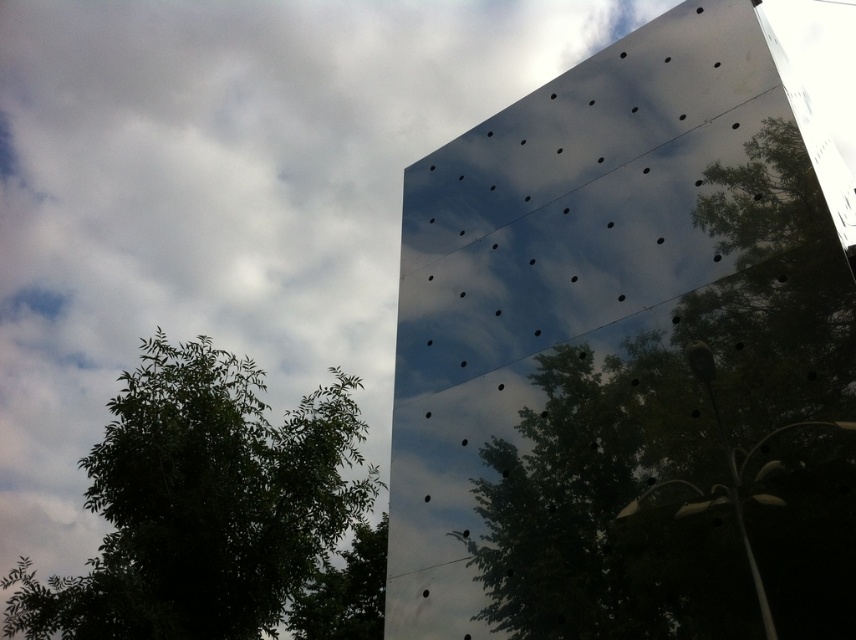
Question: Can you confirm if green leafy tree at upper center is wider than green leafy tree at lower left?

Choices:
 (A) no
 (B) yes

Answer: (B)

Question: Observing the image, what is the correct spatial positioning of green leafy tree at upper center in reference to green leafy tree at upper left?

Choices:
 (A) right
 (B) left

Answer: (A)

Question: Where is green leafy tree at upper center located in relation to green leafy tree at lower left in the image?

Choices:
 (A) right
 (B) left

Answer: (A)

Question: Estimate the real-world distances between objects in this image. Which object is closer to the green leafy tree at upper left?

Choices:
 (A) green leafy tree at lower left
 (B) green leafy tree at upper center

Answer: (A)

Question: Which point is closer to the camera?

Choices:
 (A) green leafy tree at upper left
 (B) green leafy tree at upper center
 (C) green leafy tree at lower left

Answer: (B)

Question: Which of the following is the farthest from the observer?

Choices:
 (A) green leafy tree at upper center
 (B) green leafy tree at lower left
 (C) green leafy tree at upper left

Answer: (B)